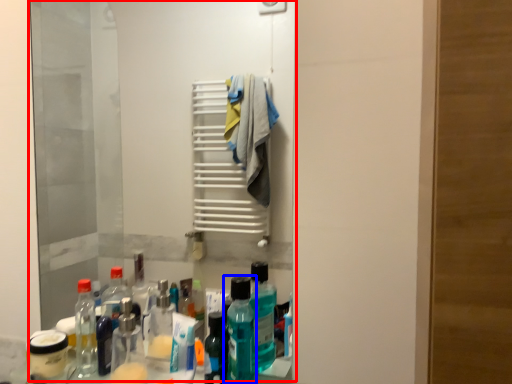
Question: Among these objects, which one is farthest to the camera, mirror (highlighted by a red box) or bottle (highlighted by a blue box)?

Choices:
 (A) mirror
 (B) bottle

Answer: (A)